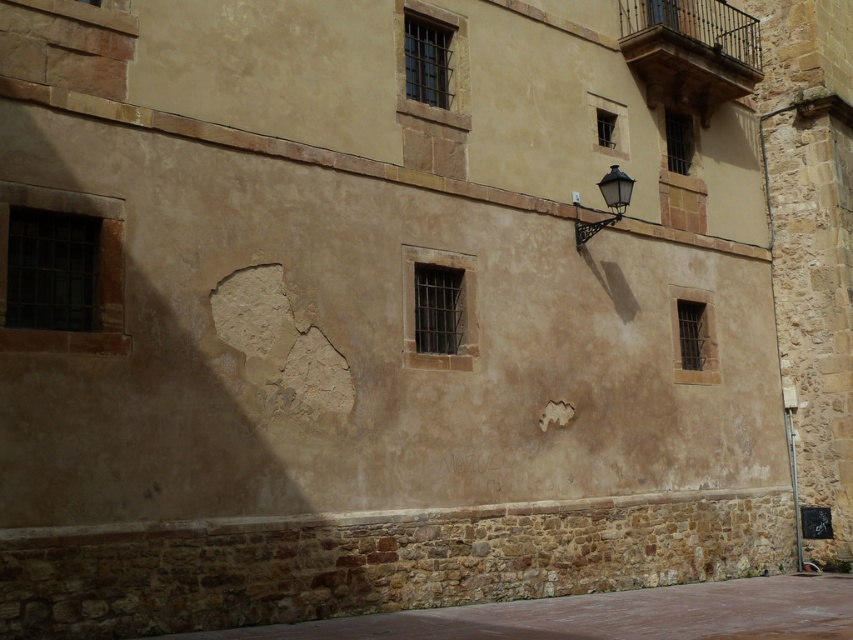
You are standing in the brown stone alley at lower center and want to reach the black metal streetlamp at upper right. Which direction should you move towards?

You should move towards the upper right direction to reach the black metal streetlamp at upper right, as the brown stone alley at lower center is in front of it.

You are standing in front of the old building and want to determine which object is taller between the brown stone alley at lower center and the black metal streetlamp at upper right. Based on the scene, which one is taller?

The brown stone alley at lower center is taller than the black metal streetlamp at upper right according to the description.

You are standing in front of the old building and want to walk from the brown stone alley at lower center to the black metal streetlamp at upper right. Which direction should you move relative to the building?

You should move to the right relative to the building because the brown stone alley at lower center is to the left of the black metal streetlamp at upper right.